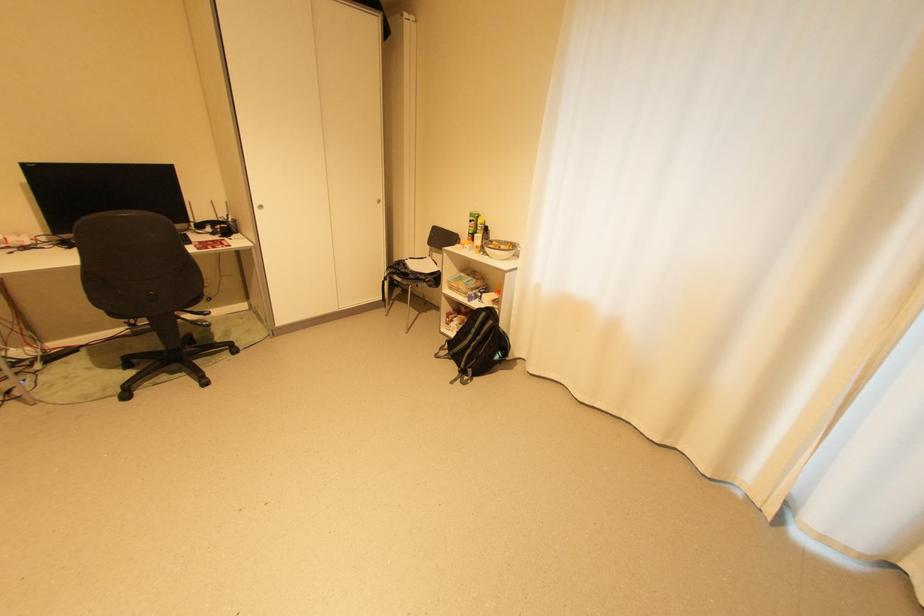
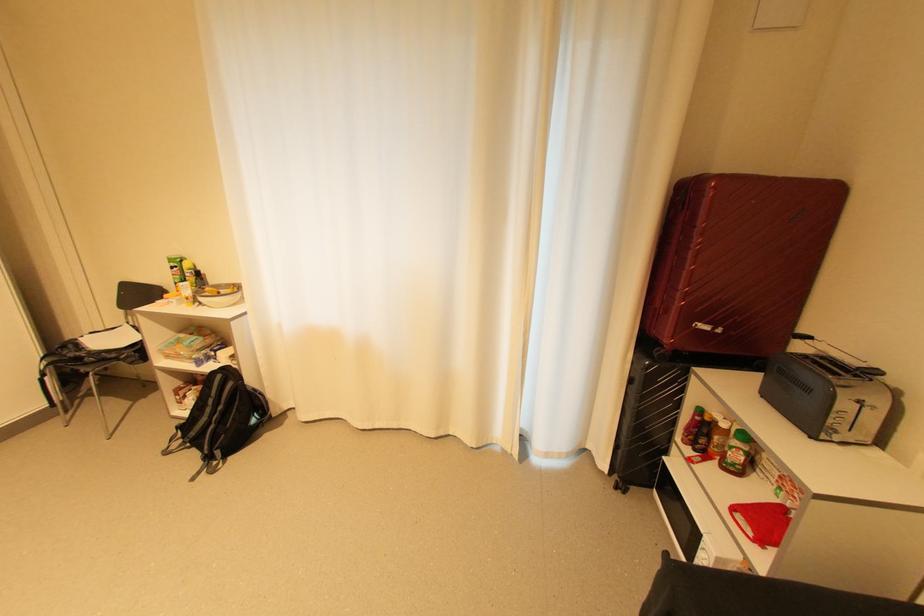
The point at (485, 245) is marked in the first image. Where is the corresponding point in the second image?

(196, 296)